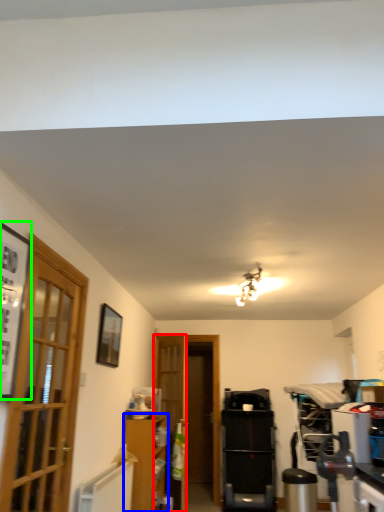
Question: Considering the real-world distances, which object is closest to door (highlighted by a red box)? cabinetry (highlighted by a blue box) or picture frame (highlighted by a green box).

Choices:
 (A) cabinetry
 (B) picture frame

Answer: (A)